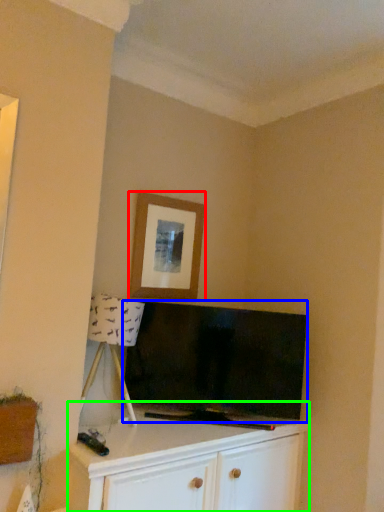
Question: Which object is the farthest from picture frame (highlighted by a red box)? Choose among these: television (highlighted by a blue box) or cabinetry (highlighted by a green box).

Choices:
 (A) television
 (B) cabinetry

Answer: (B)